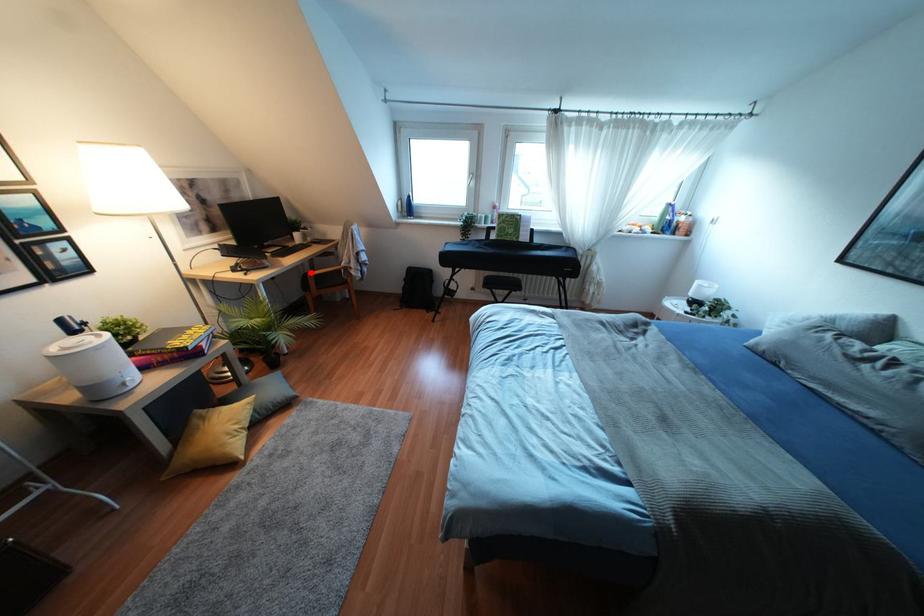
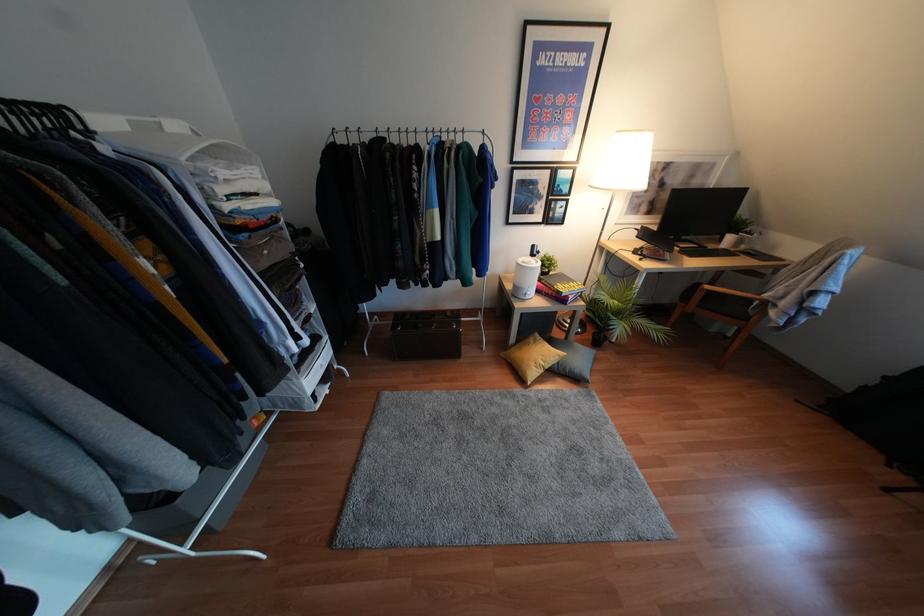
The point at the highlighted location is marked in the first image. Where is the corresponding point in the second image?

(707, 286)